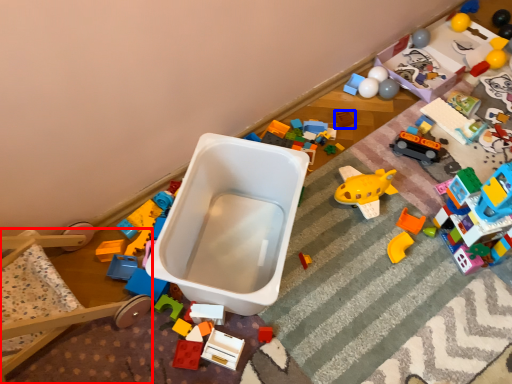
Question: Which object appears closest to the camera in this image, bunk bed (highlighted by a red box) or toy (highlighted by a blue box)?

Choices:
 (A) bunk bed
 (B) toy

Answer: (A)